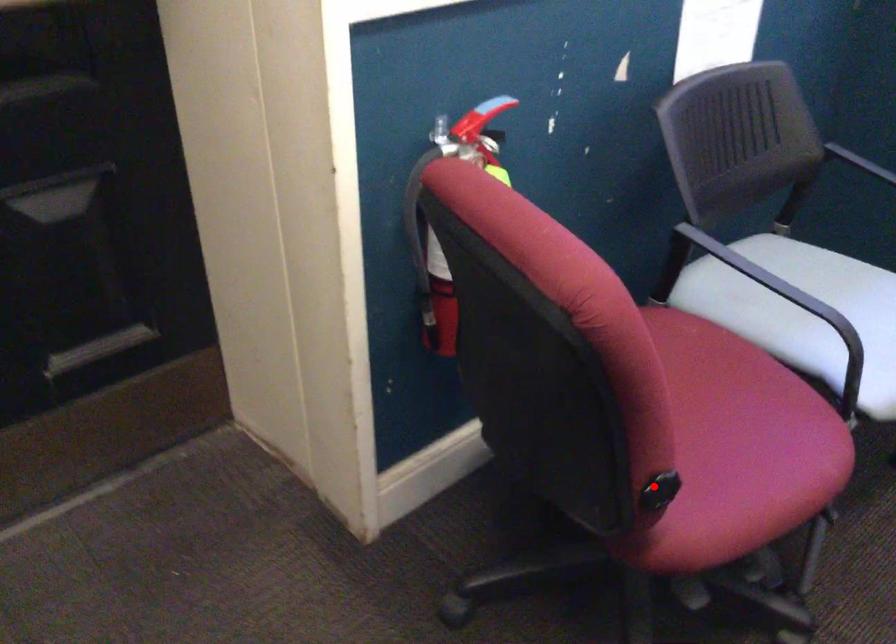
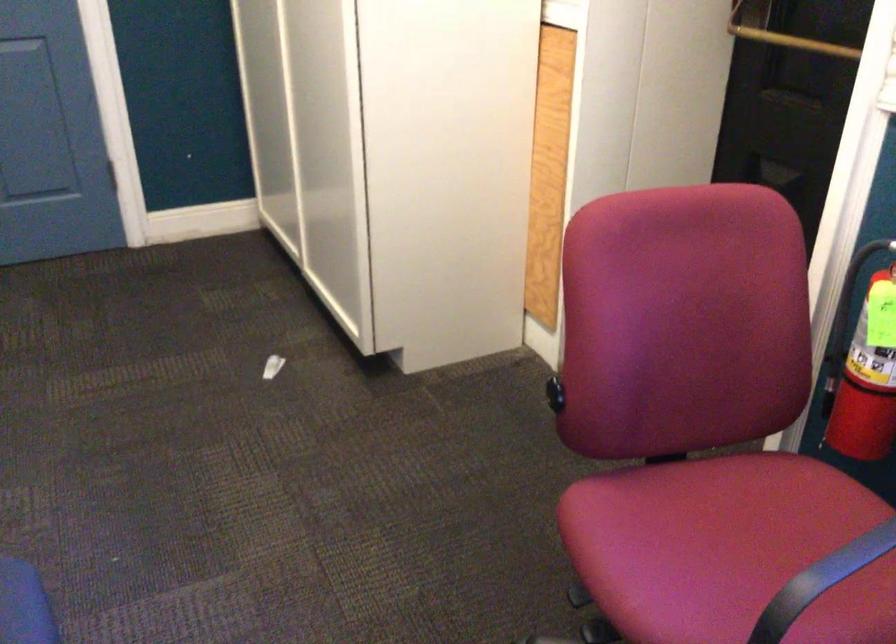
Locate, in the second image, the point that corresponds to the highlighted location in the first image.

(555, 393)